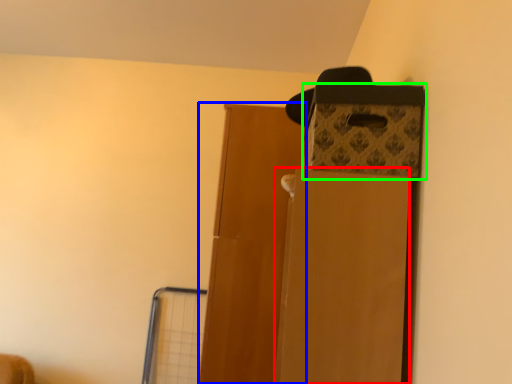
Question: Based on their relative distances, which object is nearer to cardboard box (highlighted by a red box)? Choose from door (highlighted by a blue box) and storage box (highlighted by a green box).

Choices:
 (A) door
 (B) storage box

Answer: (B)